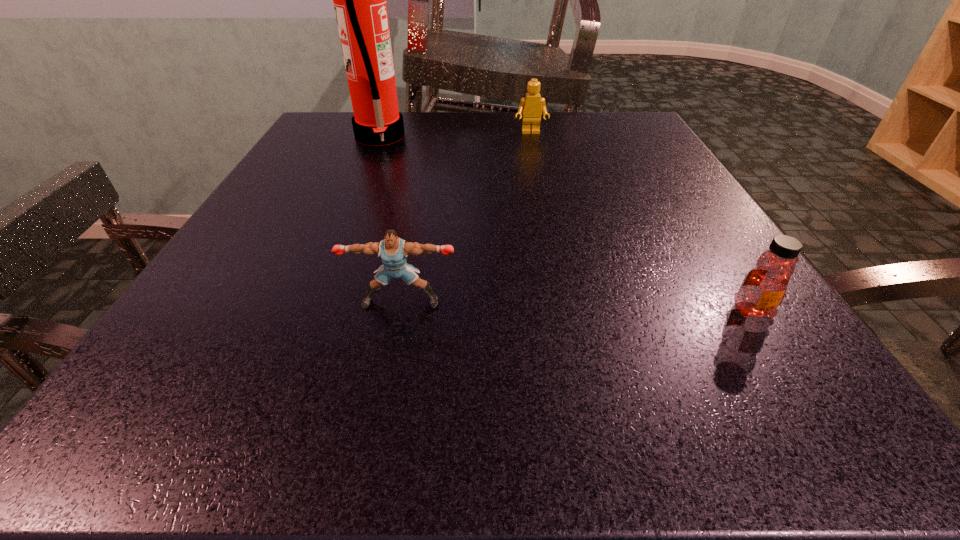
Locate an element on the screen. This screenshot has width=960, height=540. fire extinguisher is located at coordinates click(x=359, y=0).

Where is `the second object from right to left`? The width and height of the screenshot is (960, 540). the second object from right to left is located at coordinates (531, 106).

You are a GUI agent. You are given a task and a screenshot of the screen. Output one action in this format:
    pyautogui.click(x=<x>, y=<y>)
    Task: Click on the puncher
    
    Given the screenshot: What is the action you would take?
    pyautogui.click(x=393, y=251)

What are the coordinates of `the rightmost object` in the screenshot? It's located at (763, 289).

The width and height of the screenshot is (960, 540). Find the location of `free location located with the nozzle aimed from the fire extinguisher`. free location located with the nozzle aimed from the fire extinguisher is located at coordinates (580, 137).

Where is `free space located on the face of the second object from right to left`? Image resolution: width=960 pixels, height=540 pixels. free space located on the face of the second object from right to left is located at coordinates (546, 207).

Image resolution: width=960 pixels, height=540 pixels. In order to click on blank space located on the front-facing side of the puncher in this screenshot , I will do `click(385, 386)`.

Where is `blank space located on the front label of the honey`? blank space located on the front label of the honey is located at coordinates (780, 354).

The image size is (960, 540). Identify the location of fire extinguisher located at the far edge. (359, 0).

You are a GUI agent. You are given a task and a screenshot of the screen. Output one action in this format:
    pyautogui.click(x=<x>, y=<y>)
    Task: Click on the Lego located in the far edge section of the desktop
    This screenshot has height=540, width=960.
    Given the screenshot: What is the action you would take?
    pyautogui.click(x=531, y=106)